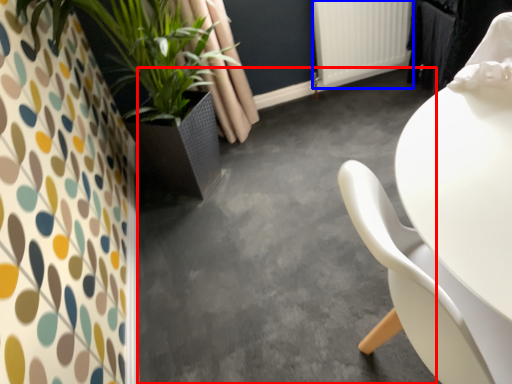
Question: Which of the following is the farthest to the observer, concrete (highlighted by a red box) or radiator (highlighted by a blue box)?

Choices:
 (A) concrete
 (B) radiator

Answer: (B)